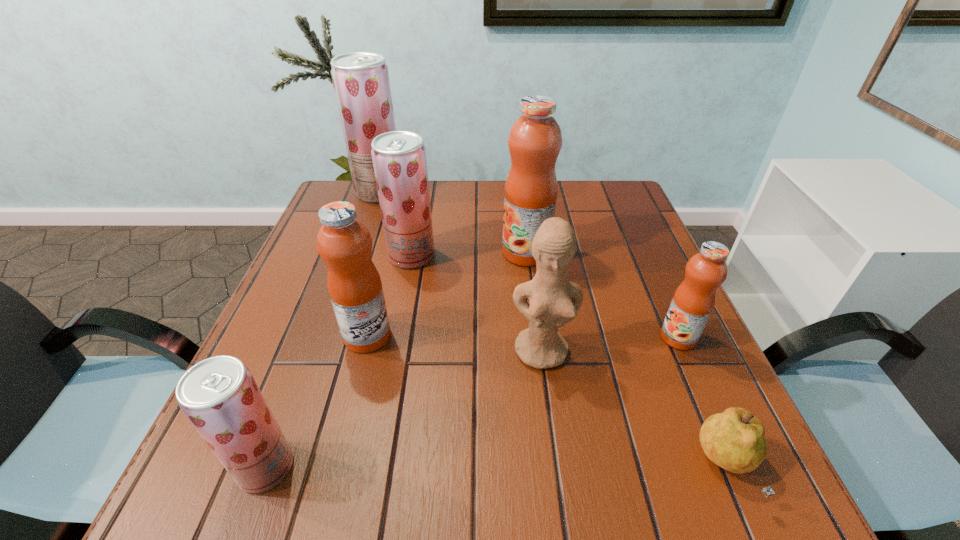
This screenshot has height=540, width=960. I want to click on strawberry fruit juice that stands as the closest to the farthest strawberry fruit juice, so click(x=399, y=158).

Where is `orange fruit juice identified as the closest to the nearest fruit juice`? This screenshot has width=960, height=540. orange fruit juice identified as the closest to the nearest fruit juice is located at coordinates (344, 243).

Locate which orange fruit juice ranks in proximity to the figurine. Please provide its 2D coordinates. Your answer should be formatted as a tuple, i.e. [(x, y)], where the tuple contains the x and y coordinates of a point satisfying the conditions above.

[(693, 302)]

This screenshot has height=540, width=960. Find the location of `free space in the image that satisfies the following two spatial constraints: 1. on the front label of the rightmost fruit juice; 2. on the front side of the pear`. free space in the image that satisfies the following two spatial constraints: 1. on the front label of the rightmost fruit juice; 2. on the front side of the pear is located at coordinates (736, 467).